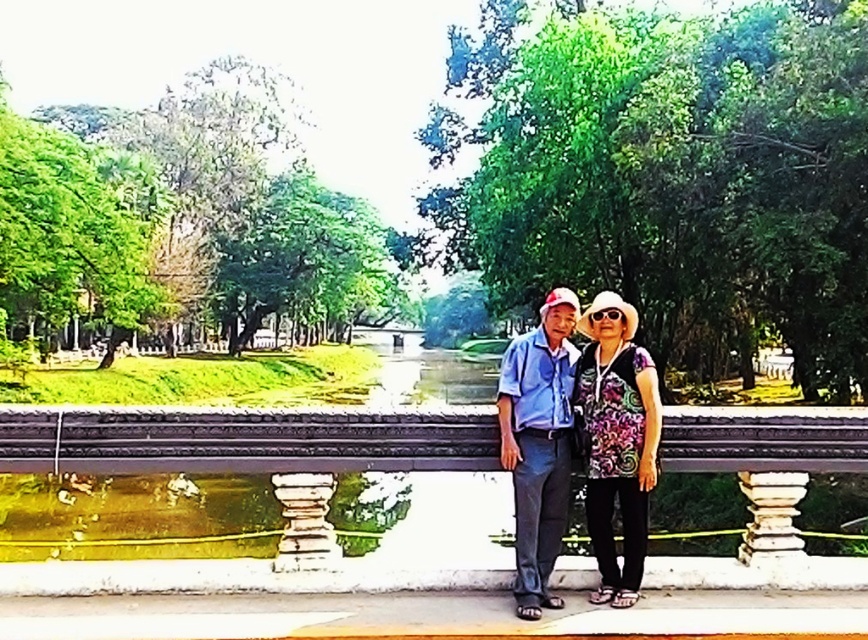
Describe the element at coordinates (241, 440) in the screenshot. I see `black textured rail at center` at that location.

Does black textured rail at center appear over blue cotton shirt at center?

Yes, black textured rail at center is above blue cotton shirt at center.

The width and height of the screenshot is (868, 640). I want to click on black textured rail at center, so click(241, 440).